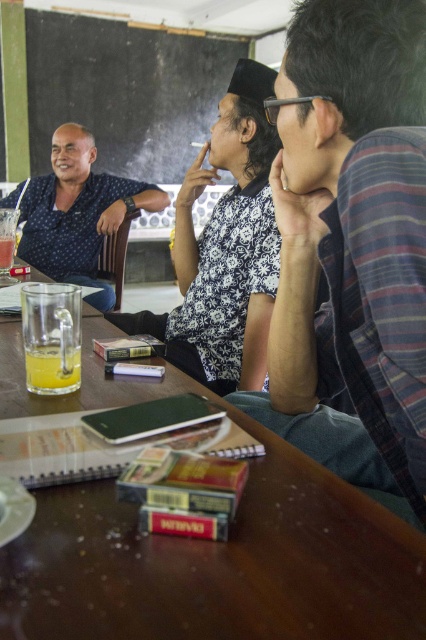
Question: Does matte black shirt at left appear on the right side of translucent glass at center?

Choices:
 (A) yes
 (B) no

Answer: (B)

Question: Which point appears farthest from the camera in this image?

Choices:
 (A) [x=250, y=326]
 (B) [x=71, y=314]
 (C) [x=40, y=212]

Answer: (C)

Question: Does plaid fabric shirt at center have a lesser width compared to white batik shirt at center?

Choices:
 (A) no
 (B) yes

Answer: (B)

Question: Estimate the real-world distances between objects in this image. Which object is closer to the brown wooden table at center?

Choices:
 (A) plaid fabric shirt at center
 (B) matte black shirt at left
 (C) white batik shirt at center
 (D) translucent glass at center

Answer: (D)

Question: Can you confirm if white batik shirt at center is positioned to the left of translucent glass at lower left?

Choices:
 (A) no
 (B) yes

Answer: (A)

Question: Which of the following is the farthest from the observer?

Choices:
 (A) translucent glass at center
 (B) white batik shirt at center
 (C) plaid fabric shirt at center

Answer: (B)